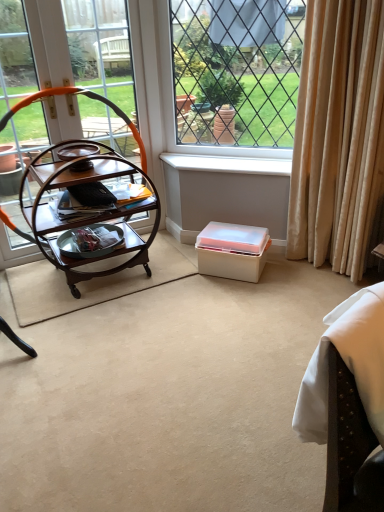
What is the approximate width of wooden trolley at left?

The width of wooden trolley at left is 21.14 inches.

This screenshot has height=512, width=384. What are the coordinates of `white fabric swivel chair at lower right` in the screenshot? It's located at (348, 401).

This screenshot has width=384, height=512. Describe the element at coordinates (236, 70) in the screenshot. I see `clear glass window at upper center` at that location.

The height and width of the screenshot is (512, 384). Identify the location of clear glass window at upper center. (236, 70).

Locate an element on the screen. Image resolution: width=384 pixels, height=512 pixels. white plastic box at center is located at coordinates (232, 251).

Do you think clear glass window at upper center is within white plastic box at center, or outside of it?

clear glass window at upper center is located beyond the bounds of white plastic box at center.

Image resolution: width=384 pixels, height=512 pixels. I want to click on window above the white plastic box at center (from a real-world perspective), so click(x=236, y=70).

From a real-world perspective, is clear glass window at upper center on white plastic box at center?

Yes, from a real-world perspective, clear glass window at upper center is over white plastic box at center

Considering the sizes of clear glass window at upper center and white plastic box at center in the image, is clear glass window at upper center taller or shorter than white plastic box at center?

clear glass window at upper center is taller than white plastic box at center.

Consider the image. Which object is further away from the camera, wooden trolley at left or white fabric swivel chair at lower right?

wooden trolley at left is further from the camera.

Is wooden trolley at left far away from white fabric swivel chair at lower right?

Indeed, wooden trolley at left is not near white fabric swivel chair at lower right.

Find the location of a particular element. Image resolution: width=384 pixels, height=512 pixels. swivel chair located in front of the wooden trolley at left is located at coordinates (348, 401).

Considering the sizes of wooden trolley at left and white fabric swivel chair at lower right in the image, is wooden trolley at left taller or shorter than white fabric swivel chair at lower right?

In the image, wooden trolley at left appears to be shorter than white fabric swivel chair at lower right.

Find the location of a particular element. window located on the left of white plastic box at center is located at coordinates (236, 70).

From a real-world perspective, is white plastic box at center positioned above or below clear glass window at upper center?

In terms of real-world spatial position, white plastic box at center is below clear glass window at upper center.

Is clear glass window at upper center at the back of white plastic box at center?

No, white plastic box at center is not facing the opposite direction of clear glass window at upper center.

Is white plastic box at center completely or partially outside of clear glass window at upper center?

Yes, white plastic box at center is outside of clear glass window at upper center.

Does metallic silver tray at center lie behind white fabric swivel chair at lower right?

Yes, metallic silver tray at center is further from the viewer.

From the image's perspective, is metallic silver tray at center on white fabric swivel chair at lower right?

Yes, from the image's perspective, metallic silver tray at center is on top of white fabric swivel chair at lower right.

Consider the image. Which point is more distant from viewer, [89,255] or [369,375]?

The point [89,255] is behind.

Is metallic silver tray at center facing away from clear glass window at upper center?

No, metallic silver tray at center's orientation is not away from clear glass window at upper center.

Is metallic silver tray at center shorter than clear glass window at upper center?

Correct, metallic silver tray at center is not as tall as clear glass window at upper center.

Measure the distance from metallic silver tray at center to clear glass window at upper center.

A distance of 3.70 feet exists between metallic silver tray at center and clear glass window at upper center.

From the picture: Which object is wider, metallic silver tray at center or clear glass window at upper center?

With larger width is clear glass window at upper center.

How distant is wooden trolley at left from white plastic box at center?

A distance of 65.19 centimeters exists between wooden trolley at left and white plastic box at center.

Is wooden trolley at left directly adjacent to white plastic box at center?

wooden trolley at left is not next to white plastic box at center, and they're not touching.

From the image's perspective, is wooden trolley at left located beneath white plastic box at center?

Actually, wooden trolley at left appears above white plastic box at center in the image.

Is wooden trolley at left positioned with its back to white plastic box at center?

No, white plastic box at center is not at the back of wooden trolley at left.

Is white fabric swivel chair at lower right surrounding white plastic window sill at center?

Definitely not — white plastic window sill at center is not inside white fabric swivel chair at lower right.

Which object is positioned more to the right, white fabric swivel chair at lower right or white plastic window sill at center?

Positioned to the right is white fabric swivel chair at lower right.

Considering the positions of point (365, 478) and point (279, 170), is point (365, 478) closer or farther from the camera than point (279, 170)?

Point (365, 478) appears to be closer to the viewer than point (279, 170).

In the scene shown: Is white plastic window sill at center at the back of white fabric swivel chair at lower right?

Correct, white fabric swivel chair at lower right is looking away from white plastic window sill at center.

Identify the location of window that appears in front of the white plastic box at center. The height and width of the screenshot is (512, 384). click(236, 70).

Find the location of a particular element. This screenshot has width=384, height=512. desk behind the white fabric swivel chair at lower right is located at coordinates (85, 195).

Considering their positions, is metallic silver tray at center positioned further to beige velvet curtain at right than white plastic box at center?

metallic silver tray at center lies further to beige velvet curtain at right than the other object.

Looking at the image, which one is located closer to metallic silver tray at center, white plastic window sill at center or wooden trolley at left?

Based on the image, wooden trolley at left appears to be nearer to metallic silver tray at center.

Looking at the image, which one is located closer to white fabric swivel chair at lower right, clear glass window at upper center or white plastic window sill at center?

white plastic window sill at center is positioned closer to the anchor white fabric swivel chair at lower right.

Considering their positions, is metallic silver tray at center positioned closer to white plastic box at center than clear glass window at upper center?

metallic silver tray at center.

Based on their spatial positions, is beige velvet curtain at right or white fabric swivel chair at lower right further from clear glass window at upper center?

white fabric swivel chair at lower right is positioned further to the anchor clear glass window at upper center.

Estimate the real-world distances between objects in this image. Which object is further from wooden trolley at left, metallic silver tray at center or white plastic window sill at center?

white plastic window sill at center is positioned further to the anchor wooden trolley at left.

Which object lies further to the anchor point metallic silver tray at center, beige velvet curtain at right or clear glass window at upper center?

Among the two, beige velvet curtain at right is located further to metallic silver tray at center.

Based on their spatial positions, is beige velvet curtain at right or white plastic window sill at center further from clear glass window at upper center?

Among the two, beige velvet curtain at right is located further to clear glass window at upper center.

At what (x,y) coordinates should I click in order to perform the action: click on box between beige velvet curtain at right and white plastic window sill at center along the z-axis. Please return your answer as a coordinate pair (x, y). This screenshot has width=384, height=512. Looking at the image, I should click on (232, 251).

The image size is (384, 512). Identify the location of window sill between metallic silver tray at center and beige velvet curtain at right in the horizontal direction. (228, 164).

Locate an element on the screen. desk positioned between white fabric swivel chair at lower right and metallic silver tray at center from near to far is located at coordinates (85, 195).

What are the coordinates of `window sill between metallic silver tray at center and clear glass window at upper center from left to right` in the screenshot? It's located at (228, 164).